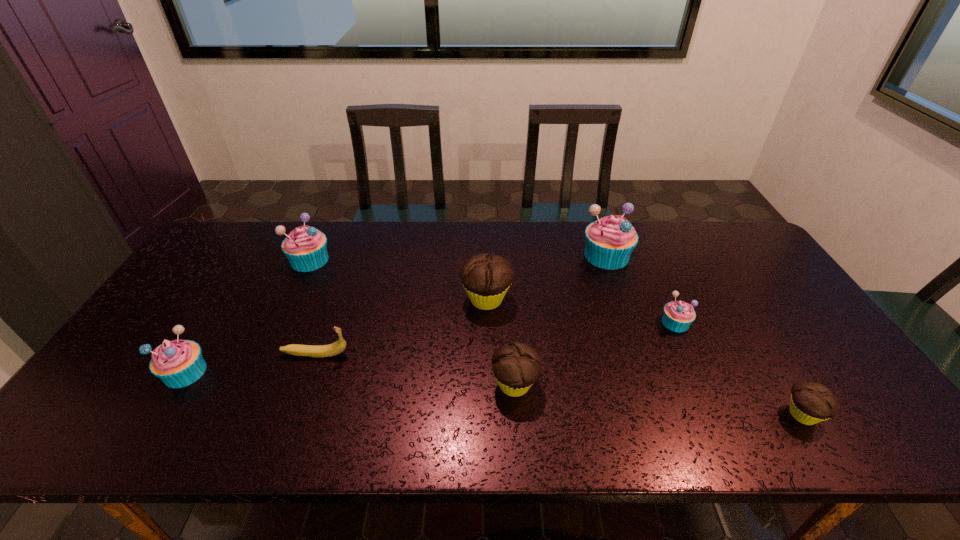
Image resolution: width=960 pixels, height=540 pixels. Find the location of `free space between the second object from right to left and the second biggest chocolate muffin`. free space between the second object from right to left and the second biggest chocolate muffin is located at coordinates (595, 354).

The width and height of the screenshot is (960, 540). What are the coordinates of `empty space between the second biggest chocolate muffin and the smallest blue muffin` in the screenshot? It's located at (595, 354).

Find the location of a particular element. The height and width of the screenshot is (540, 960). free area in between the rightmost muffin and the nearest blue muffin is located at coordinates (493, 393).

The width and height of the screenshot is (960, 540). Identify the location of vacant space that is in between the second biggest chocolate muffin and the banana. (415, 369).

At what (x,y) coordinates should I click in order to perform the action: click on vacant space that's between the second biggest chocolate muffin and the farthest chocolate muffin. Please return your answer as a coordinate pair (x, y). The height and width of the screenshot is (540, 960). Looking at the image, I should click on (500, 342).

The image size is (960, 540). In order to click on vacant space that is in between the second biggest chocolate muffin and the rightmost blue muffin in this screenshot , I will do `click(595, 354)`.

Find the location of a particular element. This screenshot has width=960, height=540. free area in between the third object from right to left and the yellow banana is located at coordinates (461, 305).

Locate an element on the screen. empty space between the second blue muffin from right to left and the second smallest chocolate muffin is located at coordinates pyautogui.click(x=561, y=320).

Find the location of a particular element. free space between the smallest chocolate muffin and the second muffin from left to right is located at coordinates (556, 338).

Select which object is the closest to the second blue muffin from left to right. Please provide its 2D coordinates. Your answer should be formatted as a tuple, i.e. [(x, y)], where the tuple contains the x and y coordinates of a point satisfying the conditions above.

[(339, 346)]